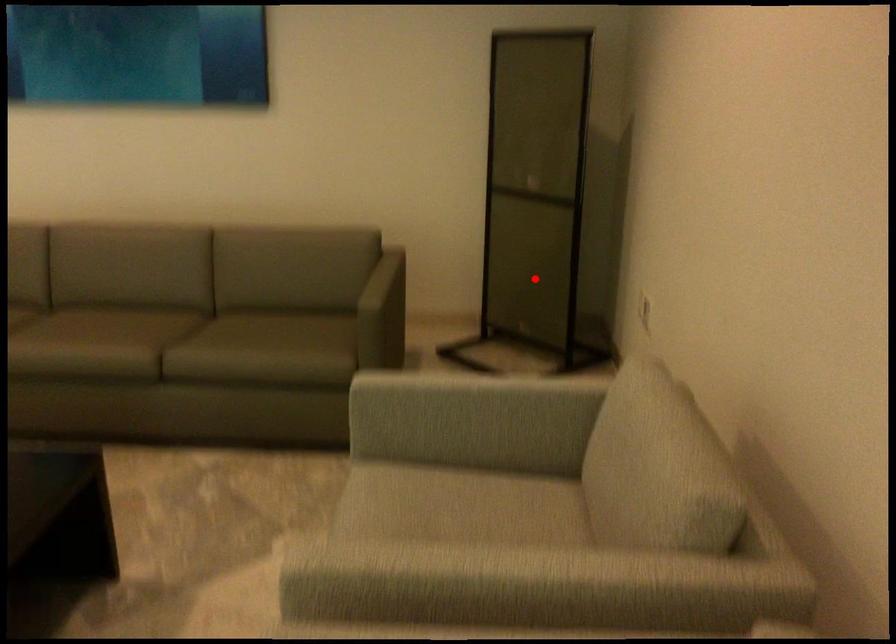
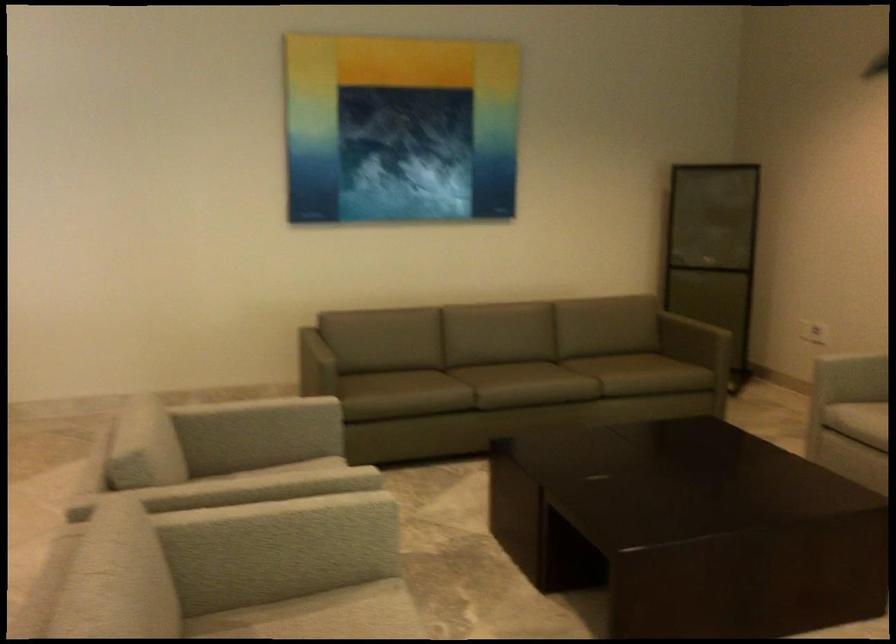
Question: A red point is marked in image1. In image2, is the corresponding 3D point closer to the camera or farther? Reply with the corresponding letter.

Choices:
 (A) The corresponding 3D point is closer.
 (B) The corresponding 3D point is farther.

Answer: (B)